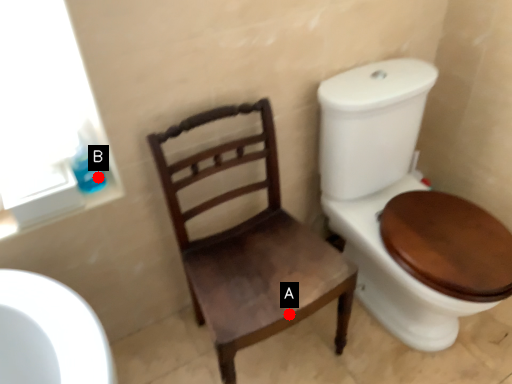
Question: Two points are circled on the image, labeled by A and B beside each circle. Which point is closer to the camera?

Choices:
 (A) A is closer
 (B) B is closer

Answer: (A)